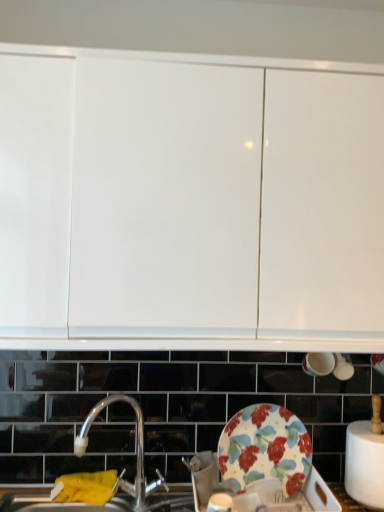
Question: Would you say floral-patterned ceramic plate at lower center is inside or outside silver metallic tap at center?

Choices:
 (A) outside
 (B) inside

Answer: (A)

Question: From the image's perspective, is floral-patterned ceramic plate at lower center positioned above or below silver metallic tap at center?

Choices:
 (A) above
 (B) below

Answer: (A)

Question: Based on their relative distances, which object is farther from the silver metallic tap at center?

Choices:
 (A) yellow fabric at lower left
 (B) white glossy cabinet at upper center
 (C) floral-patterned ceramic plate at lower center

Answer: (B)

Question: Which is farther from the silver metallic tap at center?

Choices:
 (A) yellow fabric at lower left
 (B) floral-patterned ceramic plate at lower center
 (C) white glossy cabinet at upper center

Answer: (C)